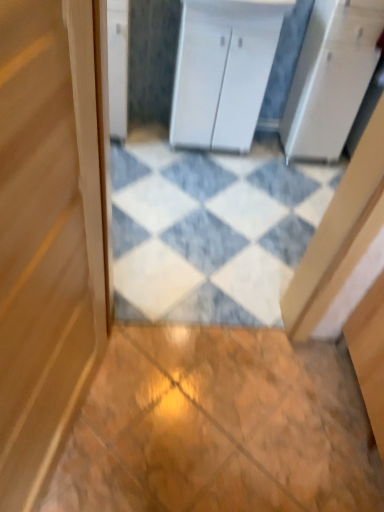
Question: From the image's perspective, is white glossy counter top at upper center located above or below white marble tile at center, arranged as the second tile when ordered from the bottom?

Choices:
 (A) below
 (B) above

Answer: (B)

Question: In terms of width, does white glossy counter top at upper center look wider or thinner when compared to white marble tile at center, which appears as the 2th tile when viewed from the front?

Choices:
 (A) thin
 (B) wide

Answer: (A)

Question: Which of these objects is positioned closest to the white marble tile at center, arranged as the second tile when ordered from the bottom?

Choices:
 (A) wooden door at center
 (B) white matte cabinet at center, the first cabinetry positioned from the right
 (C) white glossy cabinet at upper left, arranged as the first cabinetry when viewed from the left
 (D) white glossy counter top at upper center
 (E) wooden tile at center, the first tile positioned from the front

Answer: (B)

Question: Estimate the real-world distances between objects in this image. Which object is closer to the white glossy cabinet at upper left, arranged as the first cabinetry when viewed from the left?

Choices:
 (A) white matte cabinet at center, the first cabinetry positioned from the right
 (B) white glossy counter top at upper center
 (C) wooden tile at center, the 1th tile when ordered from bottom to top
 (D) white marble tile at center, marked as the 1th tile in a back-to-front arrangement
 (E) wooden door at center

Answer: (A)